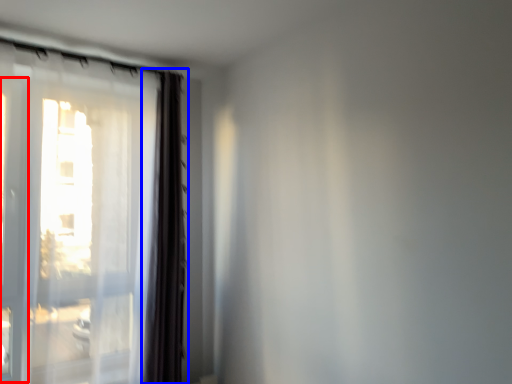
Question: Which point is closer to the camera, screen door (highlighted by a red box) or curtain (highlighted by a blue box)?

Choices:
 (A) screen door
 (B) curtain

Answer: (A)